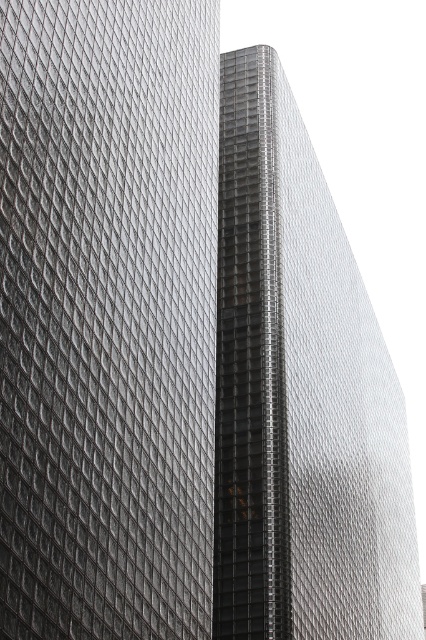
Question: Which object appears farthest from the camera in this image?

Choices:
 (A) metallic glass skyscraper at left
 (B) metallic glass tower at center

Answer: (B)

Question: Can you confirm if metallic glass skyscraper at left is smaller than metallic glass tower at center?

Choices:
 (A) no
 (B) yes

Answer: (B)

Question: From the image, what is the correct spatial relationship of metallic glass skyscraper at left in relation to metallic glass tower at center?

Choices:
 (A) right
 (B) left

Answer: (B)

Question: Is metallic glass skyscraper at left smaller than metallic glass tower at center?

Choices:
 (A) yes
 (B) no

Answer: (A)